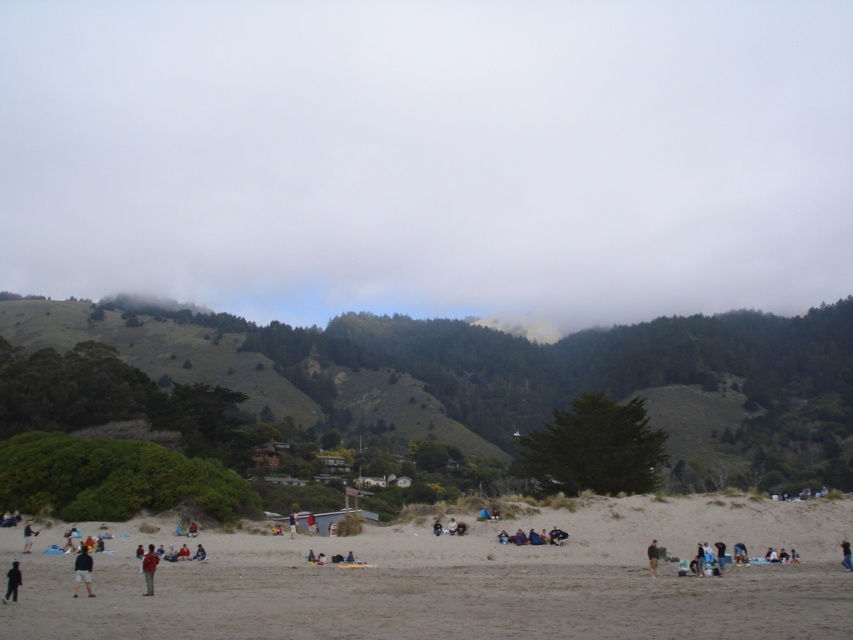
Consider the image. Is light brown sand at center further to camera compared to dark gray fabric jacket at lower left?

No.

Which is in front, point (508, 570) or point (74, 563)?

Point (508, 570) is more forward.

Image resolution: width=853 pixels, height=640 pixels. I want to click on light brown sand at center, so click(460, 579).

Does dark gray fabric jacket at lower left appear over dark blue jeans at lower center?

Indeed, dark gray fabric jacket at lower left is positioned over dark blue jeans at lower center.

Based on the photo, can you confirm if dark gray fabric jacket at lower left is wider than dark blue jeans at lower center?

Incorrect, dark gray fabric jacket at lower left's width does not surpass dark blue jeans at lower center's.

Between point (90, 563) and point (289, 513), which one is positioned in front?

Positioned in front is point (90, 563).

Image resolution: width=853 pixels, height=640 pixels. In order to click on dark gray fabric jacket at lower left in this screenshot , I will do `click(82, 570)`.

Is dark gray fabric jacket at lower left thinner than red fabric jacket at lower left?

In fact, dark gray fabric jacket at lower left might be wider than red fabric jacket at lower left.

Is point (77, 563) behind point (151, 576)?

No, it is in front of (151, 576).

Where is `dark gray fabric jacket at lower left`? The height and width of the screenshot is (640, 853). dark gray fabric jacket at lower left is located at coordinates (82, 570).